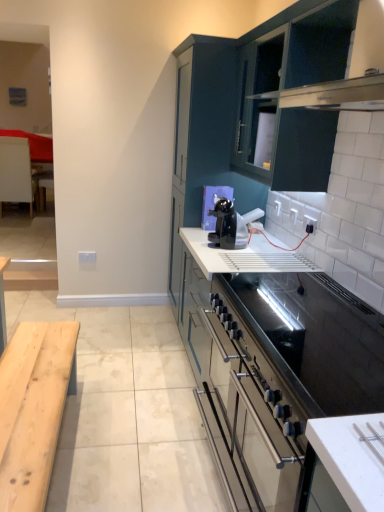
The width and height of the screenshot is (384, 512). Find the location of `blank space to the left of black glossy coffee machine at center`. blank space to the left of black glossy coffee machine at center is located at coordinates (203, 242).